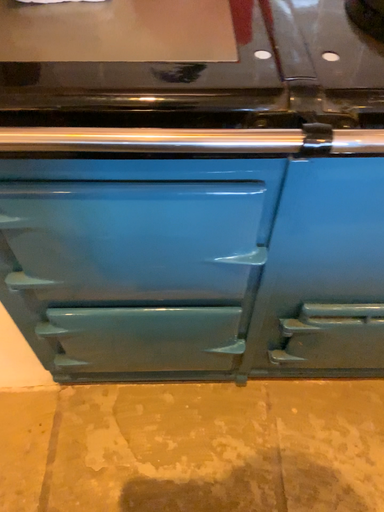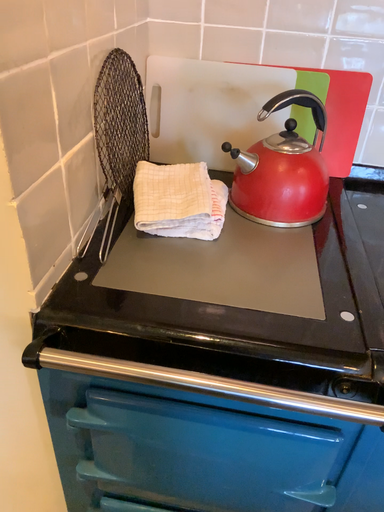
Question: Which way did the camera rotate in the video?

Choices:
 (A) rotated upward
 (B) rotated downward

Answer: (A)